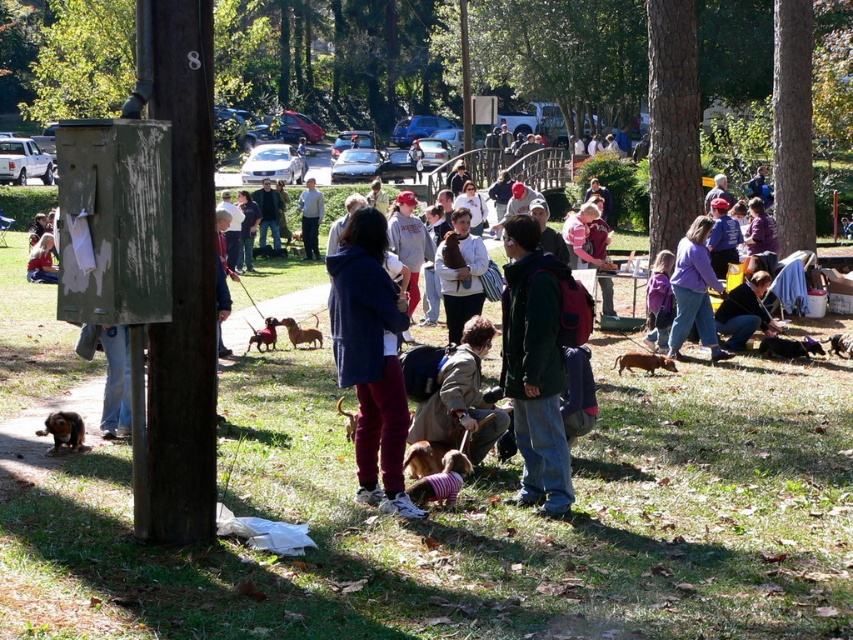
Who is shorter, dark blue jacket at center or dark green jacket at center?

With less height is dark green jacket at center.

Is dark blue jacket at center shorter than dark green jacket at center?

Incorrect, dark blue jacket at center's height does not fall short of dark green jacket at center's.

The width and height of the screenshot is (853, 640). What do you see at coordinates (370, 356) in the screenshot?
I see `dark blue jacket at center` at bounding box center [370, 356].

Identify the location of dark blue jacket at center. (370, 356).

Who is more forward, (338,250) or (659,252)?

Point (338,250) is in front.

Does point (380, 442) lie in front of point (660, 272)?

Yes, point (380, 442) is in front of point (660, 272).

Where is `dark blue jacket at center`? This screenshot has height=640, width=853. dark blue jacket at center is located at coordinates (370, 356).

Who is taller, dark blue jacket at center or brown furry dog at lower center?

With more height is dark blue jacket at center.

Which is more to the right, dark blue jacket at center or brown furry dog at lower center?

Positioned to the right is brown furry dog at lower center.

Who is more distant from viewer, (x=355, y=337) or (x=616, y=365)?

The point (x=616, y=365) is more distant.

In order to click on dark blue jacket at center in this screenshot , I will do `click(370, 356)`.